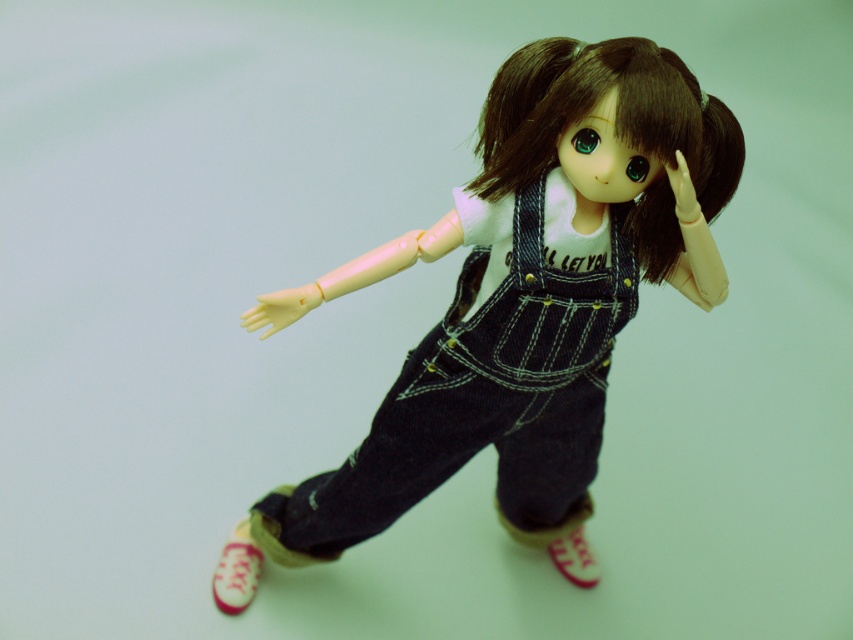
Which is more to the right, brownsmoothhair at center or pink fabric shoe at lower left?

Positioned to the right is brownsmoothhair at center.

Based on the photo, is brownsmoothhair at center shorter than pink fabric shoe at lower left?

No, brownsmoothhair at center is not shorter than pink fabric shoe at lower left.

Does point (527, 125) lie in front of point (239, 586)?

That is True.

Identify the location of brownsmoothhair at center. Image resolution: width=853 pixels, height=640 pixels. (614, 115).

How distant is denim overalls at center from matte pink rubber shoe at lower center?

denim overalls at center and matte pink rubber shoe at lower center are 13.82 inches apart from each other.

Does point (630, 61) come farther from viewer compared to point (579, 548)?

No, (630, 61) is in front of (579, 548).

Describe the element at coordinates (531, 292) in the screenshot. I see `denim overalls at center` at that location.

At what (x,y) coordinates should I click in order to perform the action: click on denim overalls at center. Please return your answer as a coordinate pair (x, y). The image size is (853, 640). Looking at the image, I should click on (531, 292).

Is yellow matte hand at lower left shorter than matte plastic hand at upper right?

Indeed, yellow matte hand at lower left has a lesser height compared to matte plastic hand at upper right.

Consider the image. Between yellow matte hand at lower left and matte plastic hand at upper right, which one has less height?

yellow matte hand at lower left is shorter.

At what (x,y) coordinates should I click in order to perform the action: click on yellow matte hand at lower left. Please return your answer as a coordinate pair (x, y). Looking at the image, I should click on (281, 308).